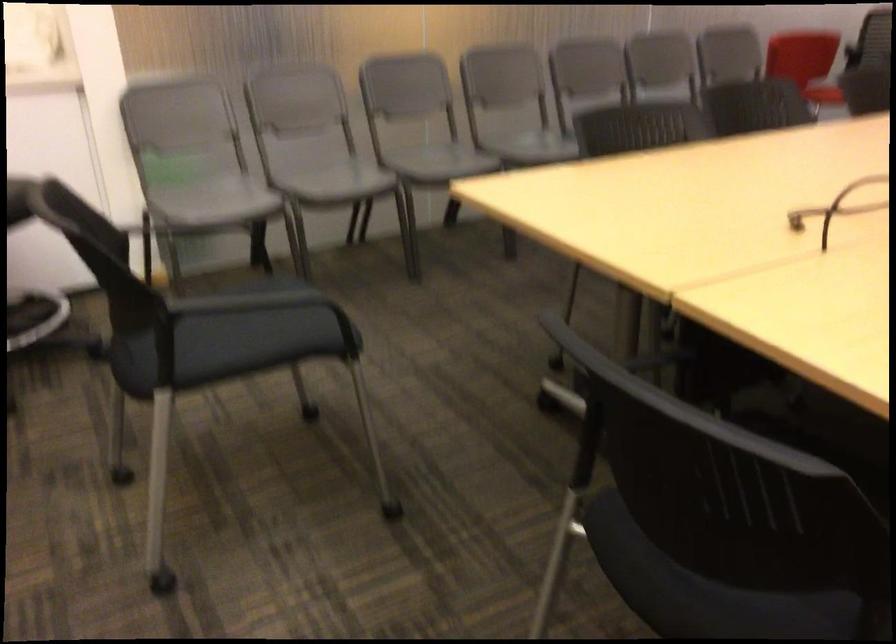
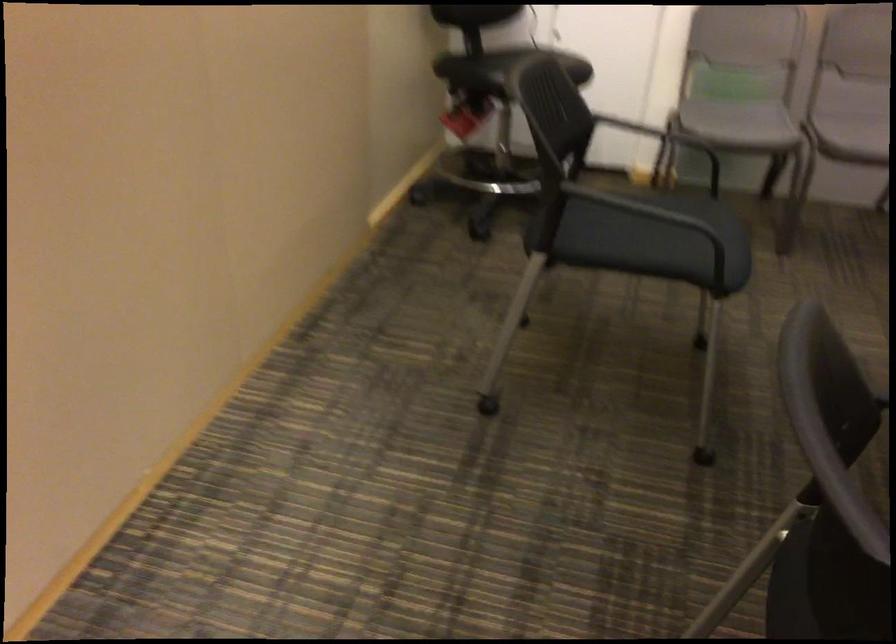
Question: I am providing you with two images of the same scene from different viewpoints. Which of the following objects are not visible in image2?

Choices:
 (A) grey chair sitting surface
 (B) black office chair seat
 (C) black chair sitting surface
 (D) none of these

Answer: (D)